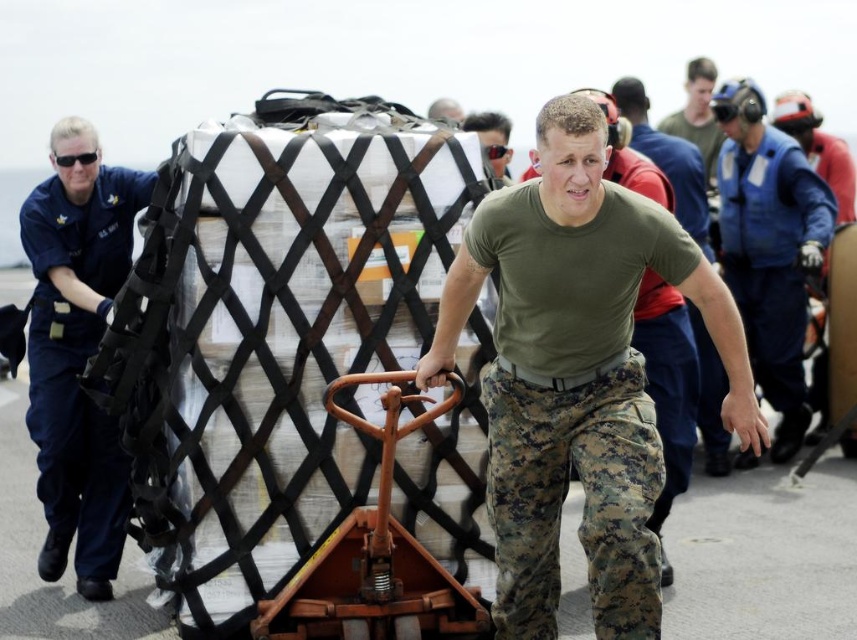
You are a safety inspector observing the scene. You notice the blue uniform at center and the matte black sunglasses at center. Which object is wider from your perspective?

The blue uniform at center is wider than the matte black sunglasses at center according to the description.